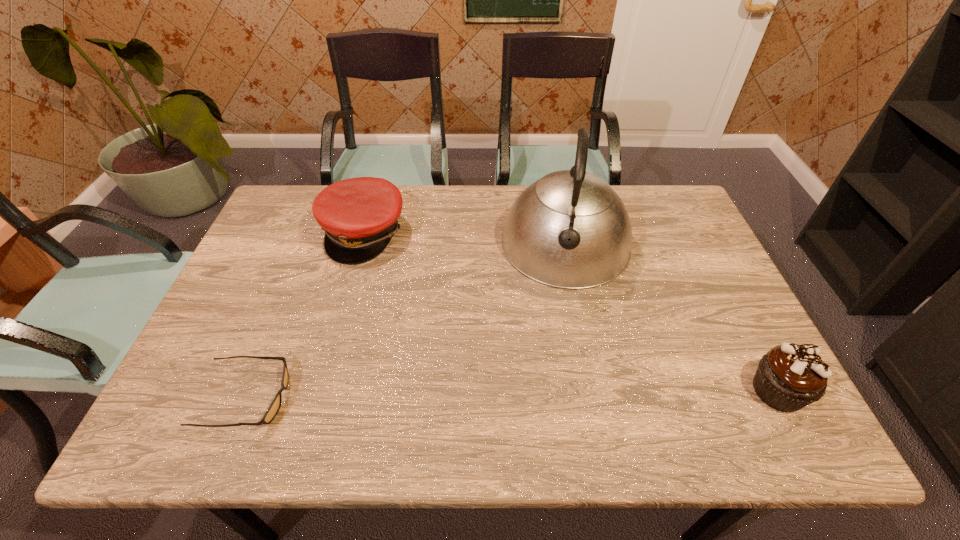
You are a GUI agent. You are given a task and a screenshot of the screen. Output one action in this format:
    pyautogui.click(x=<x>, y=<y>)
    Task: Click on the free space located at the front of the cap where the visor is located
    The width and height of the screenshot is (960, 540).
    Given the screenshot: What is the action you would take?
    pyautogui.click(x=430, y=309)

Image resolution: width=960 pixels, height=540 pixels. Identify the location of free point located at the front of the cap where the visor is located. (425, 305).

Image resolution: width=960 pixels, height=540 pixels. What are the coordinates of `free location located at the front of the cap where the visor is located` in the screenshot? It's located at (445, 327).

What are the coordinates of `kettle present at the far edge` in the screenshot? It's located at (570, 229).

Where is `cap that is positioned at the far edge`? cap that is positioned at the far edge is located at coordinates (359, 215).

Where is `sunglasses that is at the near edge`? This screenshot has width=960, height=540. sunglasses that is at the near edge is located at coordinates (274, 407).

Locate an element on the screen. Image resolution: width=960 pixels, height=540 pixels. cupcake at the near edge is located at coordinates (789, 377).

Where is `object positioned at the left edge`? Image resolution: width=960 pixels, height=540 pixels. object positioned at the left edge is located at coordinates (274, 407).

Identify the location of object that is at the right edge. This screenshot has width=960, height=540. [789, 377].

Locate an element on the screen. object located at the near left corner is located at coordinates (274, 407).